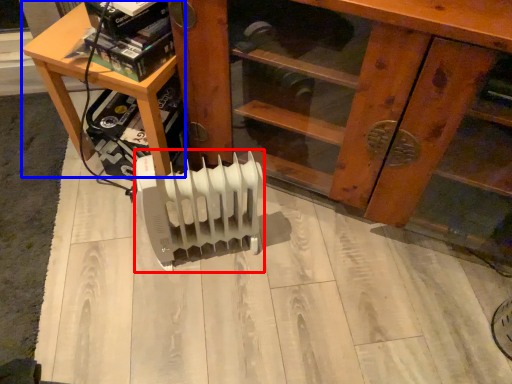
Question: Among these objects, which one is farthest to the camera, heater (highlighted by a red box) or table (highlighted by a blue box)?

Choices:
 (A) heater
 (B) table

Answer: (B)